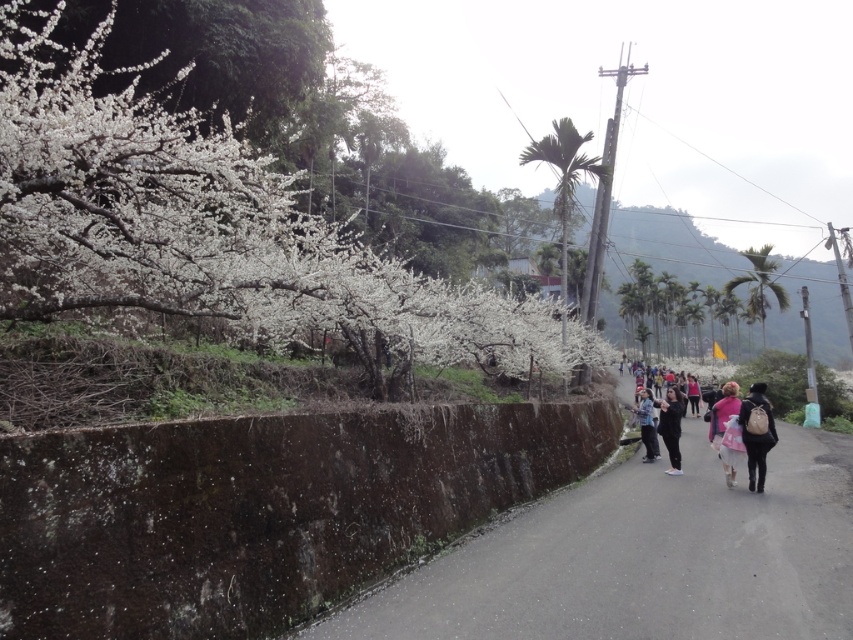
Question: Estimate the real-world distances between objects in this image. Which object is closer to the denim jacket at lower right?

Choices:
 (A) green leafy palm at center
 (B) pink fabric at center-right
 (C) matte black backpack at right
 (D) pink fabric bag at center-right

Answer: (D)

Question: Does dark brown asphalt road at center lie in front of black matte pants at center-right?

Choices:
 (A) yes
 (B) no

Answer: (A)

Question: Which point is farther to the camera?

Choices:
 (A) green leafy palm at center
 (B) pink fabric bag at center-right

Answer: (A)

Question: Which object is the closest to the pink fabric bag at center-right?

Choices:
 (A) black matte pants at center-right
 (B) pink fabric at center-right

Answer: (A)

Question: From the image, what is the correct spatial relationship of green leafy palm at center in relation to green leafy palm tree at right?

Choices:
 (A) left
 (B) right

Answer: (A)

Question: Is the position of matte black backpack at right less distant than that of black matte pants at center-right?

Choices:
 (A) no
 (B) yes

Answer: (B)